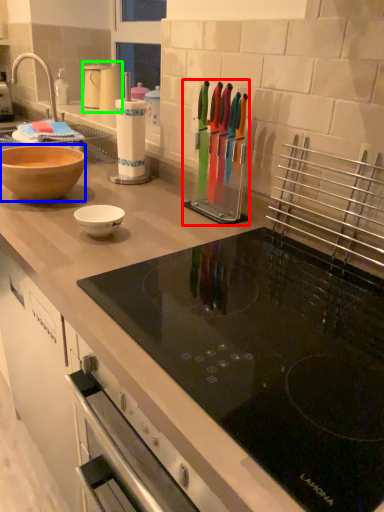
Question: Based on their relative distances, which object is nearer to appliance (highlighted by a red box)? Choose from bowl (highlighted by a blue box) and kitchen appliance (highlighted by a green box).

Choices:
 (A) bowl
 (B) kitchen appliance

Answer: (A)